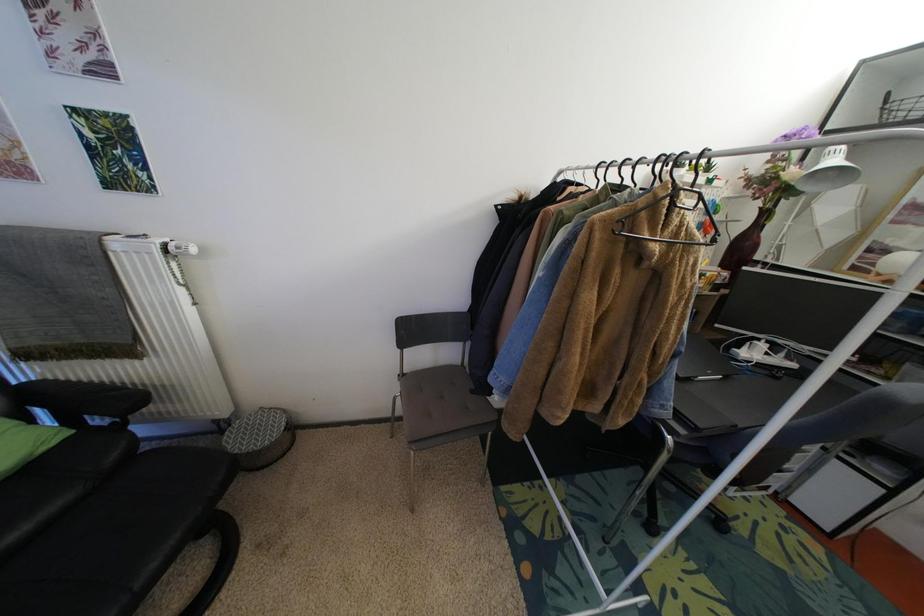
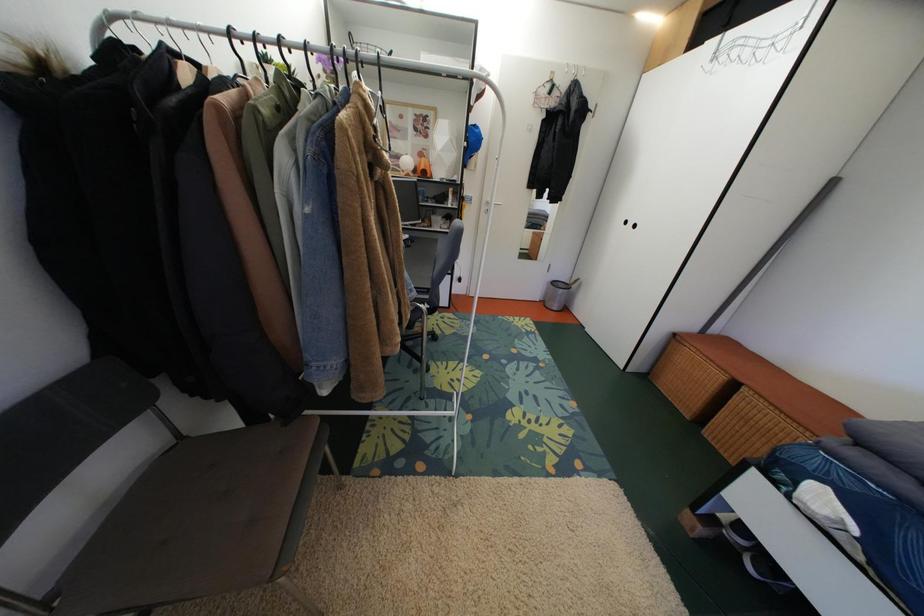
First-person continuous shooting, in which direction is the camera rotating?

The rotation direction of the camera is right-down.